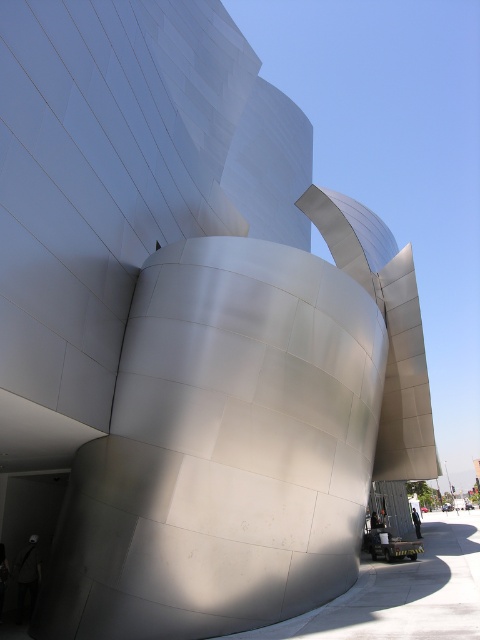
Is dark gray fabric bag at lower left shorter than dark blue jeans at lower right?

Yes.

In the scene shown: Between dark gray fabric bag at lower left and dark blue jeans at lower right, which one has more height?

dark blue jeans at lower right is taller.

Does point (27, 557) lie in front of point (416, 516)?

Yes, it is in front of point (416, 516).

You are a GUI agent. You are given a task and a screenshot of the screen. Output one action in this format:
    pyautogui.click(x=<x>, y=<y>)
    Task: Click on the dark gray fabric bag at lower left
    The width and height of the screenshot is (480, 640).
    Given the screenshot: What is the action you would take?
    pyautogui.click(x=27, y=577)